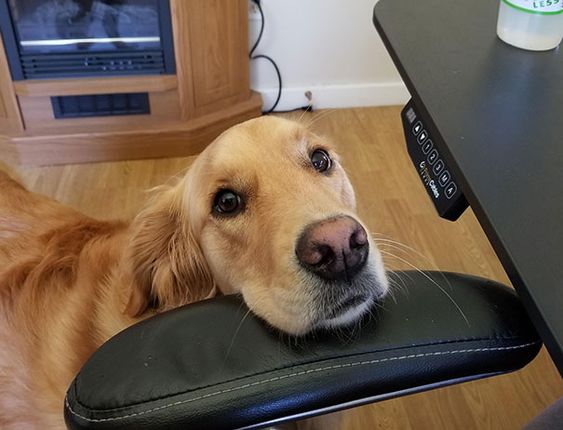
Find the location of a particular element. Image resolution: width=563 pixels, height=430 pixels. floor is located at coordinates (378, 190), (100, 188).